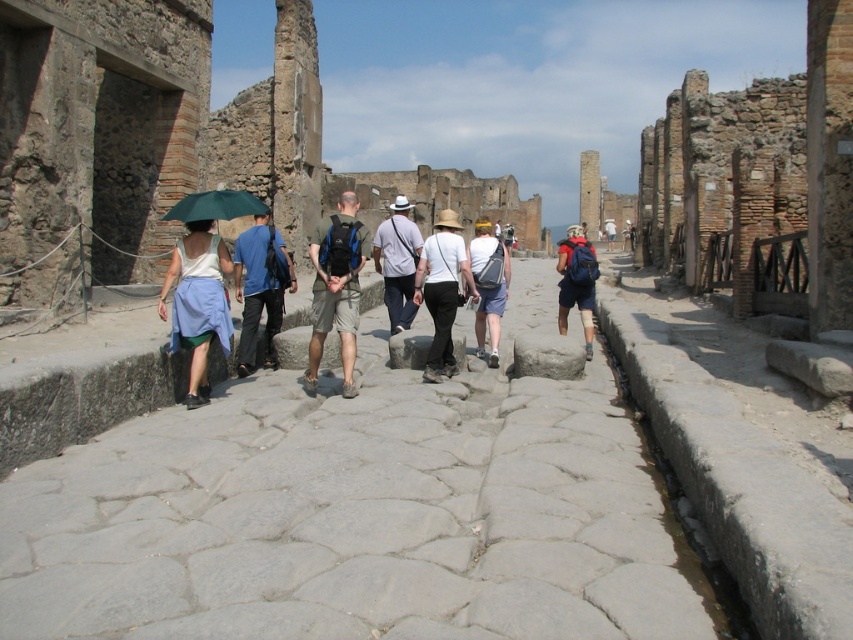
Question: Can you confirm if blue denim jeans at center is positioned to the left of light gray fabric hat at center?

Choices:
 (A) yes
 (B) no

Answer: (A)

Question: Which point is farther to the camera?

Choices:
 (A) denim shorts at center
 (B) blue denim jeans at center

Answer: (A)

Question: Is light blue fabric skirt at left closer to camera compared to blue denim shorts at center?

Choices:
 (A) yes
 (B) no

Answer: (A)

Question: Which point is closer to the camera?

Choices:
 (A) denim shorts at center
 (B) blue denim jeans at center
 (C) green matte umbrella at center
 (D) white fabric hat at center

Answer: (C)

Question: Does blue denim jeans at center have a greater width compared to green matte umbrella at center?

Choices:
 (A) yes
 (B) no

Answer: (B)

Question: Which object is farther from the camera taking this photo?

Choices:
 (A) green fabric backpack at center
 (B) green matte umbrella at center

Answer: (B)